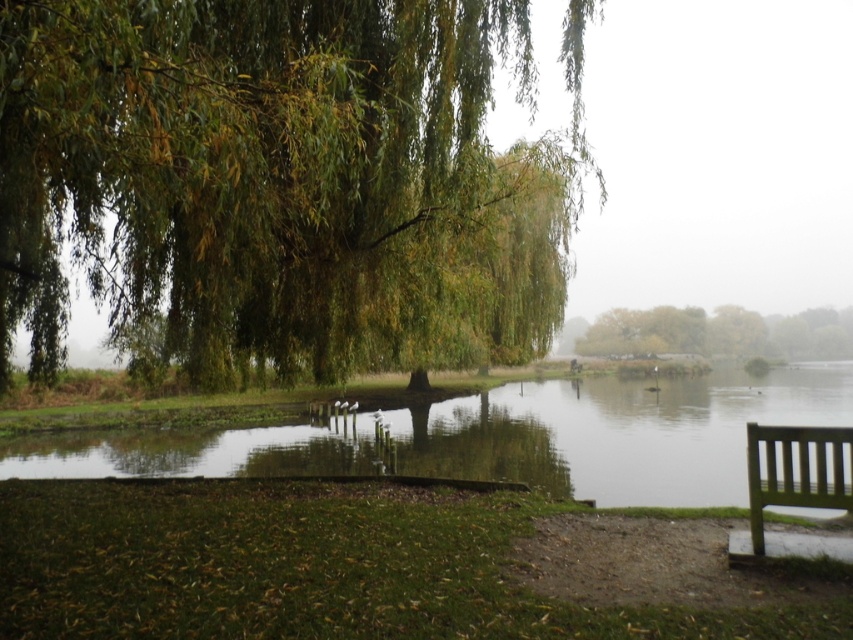
You are standing at the green wooden bench at lower right and want to take a photo of the green leafy willow at upper left. Which direction should you face to capture the willow in your view?

You should face to the left to capture the green leafy willow at upper left since it is positioned to the left of the green wooden bench at lower right.

You are standing at the edge of the lake and see the point marked at coordinates (241, 164). What object is located at that point?

The point at coordinates (241, 164) corresponds to the green leafy willow at upper left.